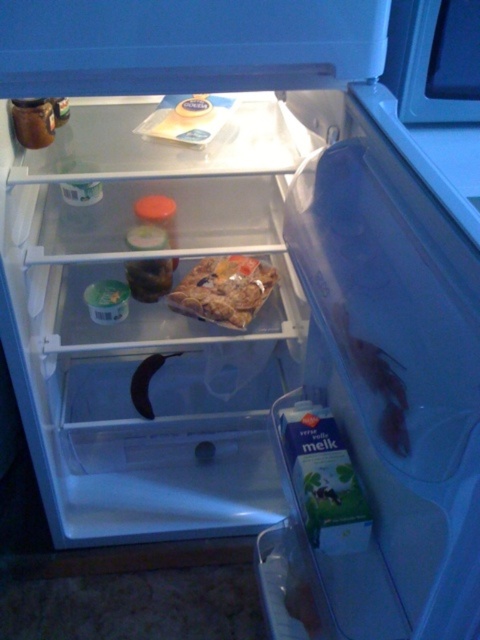
Does translucent plastic bag of cookies at center have a smaller size compared to translucent plastic milk carton at lower right?

No.

Between translucent plastic bag of cookies at center and translucent plastic milk carton at lower right, which one appears on the left side from the viewer's perspective?

Positioned to the left is translucent plastic bag of cookies at center.

The width and height of the screenshot is (480, 640). Describe the element at coordinates (225, 291) in the screenshot. I see `translucent plastic bag of cookies at center` at that location.

Where is `translucent plastic bag of cookies at center`? This screenshot has width=480, height=640. translucent plastic bag of cookies at center is located at coordinates (225, 291).